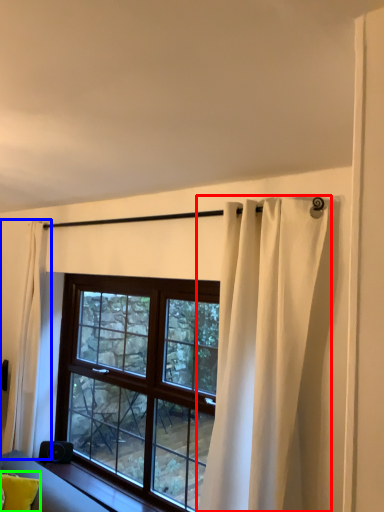
Question: Based on their relative distances, which object is farther from curtain (highlighted by a red box)? Choose from curtain (highlighted by a blue box) and pillow (highlighted by a green box).

Choices:
 (A) curtain
 (B) pillow

Answer: (A)